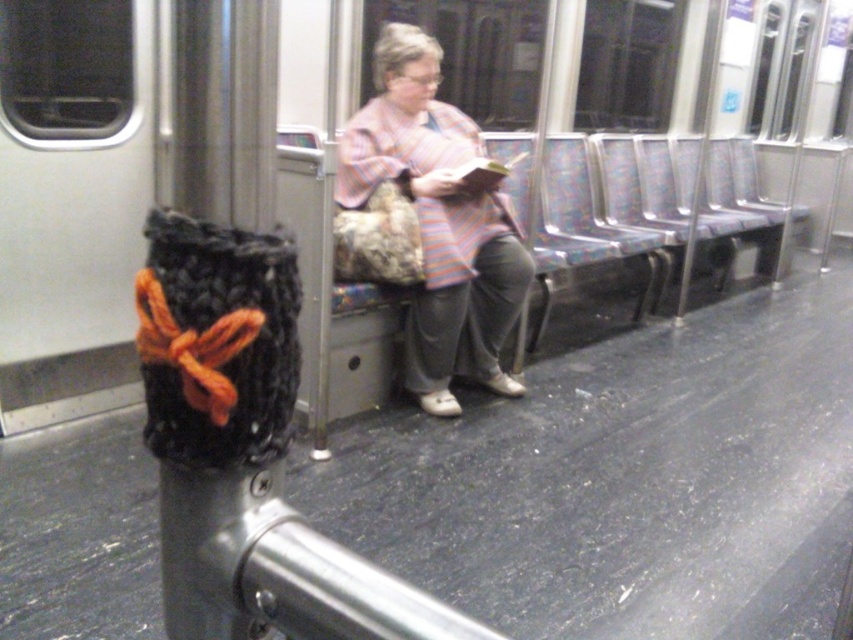
Question: Which of the following is the closest to the observer?

Choices:
 (A) (340, 145)
 (B) (260, 70)

Answer: (B)

Question: Is black knitted bag at center further to camera compared to striped fabric jacket at center?

Choices:
 (A) no
 (B) yes

Answer: (A)

Question: Does black knitted bag at center have a smaller size compared to striped fabric jacket at center?

Choices:
 (A) yes
 (B) no

Answer: (A)

Question: Which point is farther to the camera?

Choices:
 (A) (810, 90)
 (B) (454, 225)

Answer: (A)

Question: Can you confirm if black knitted bag at center is positioned to the left of striped fabric jacket at center?

Choices:
 (A) no
 (B) yes

Answer: (B)